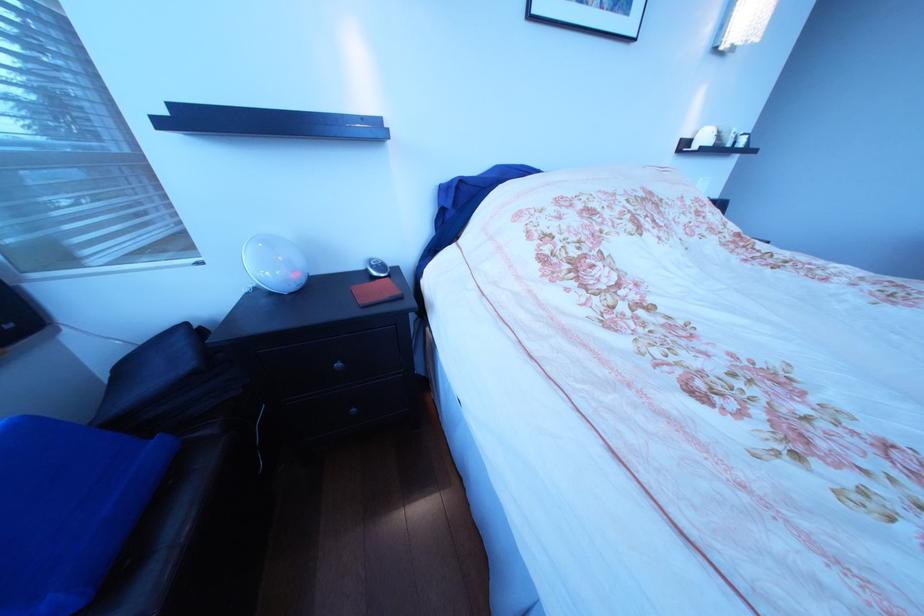
Identify the location of red leather case. The height and width of the screenshot is (616, 924). (375, 292).